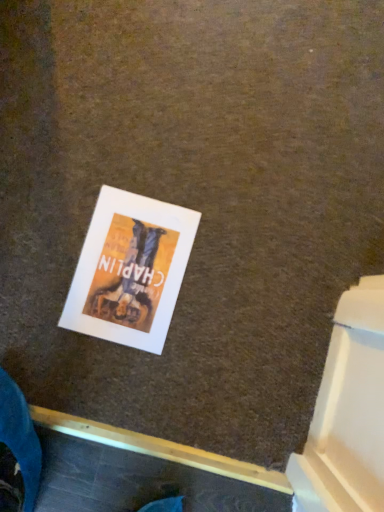
Identify the location of vacant area located to the right-hand side of matte paper poster at center. The image size is (384, 512). (235, 287).